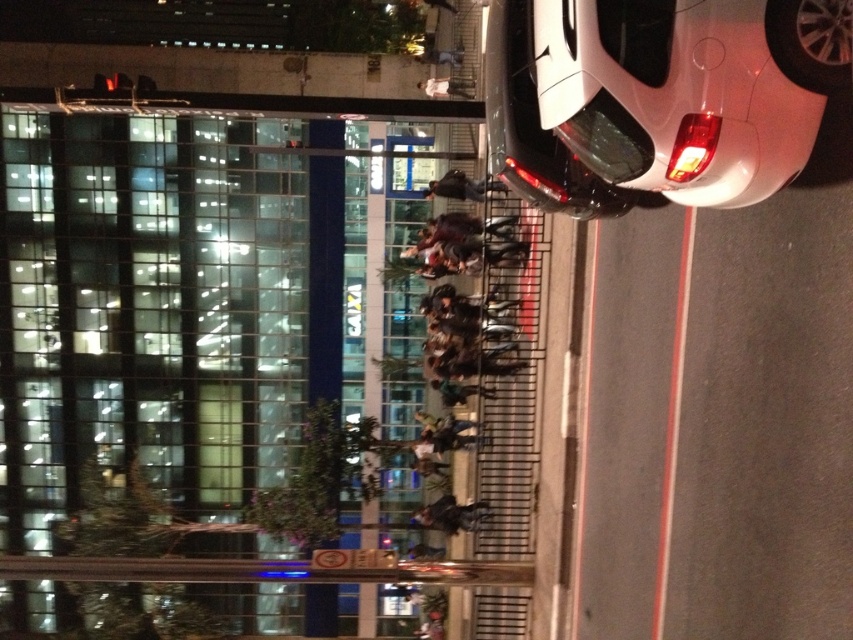
You are a photographer trying to capture a wide shot of the transparent glass building at upper left and the white glossy car at right. Based on their sizes in the image, which object would require a wider angle lens to include fully in the frame?

The transparent glass building at upper left requires a wider angle lens because its width surpasses that of the white glossy car at right, making it harder to fit into the frame without cropping.

You are a delivery driver who needs to turn left onto a street. You see the transparent glass building at upper left and the white glossy car at right. Which object is closer to you as you prepare to make the turn?

The transparent glass building at upper left is closer to you because the white glossy car at right is behind it, indicating the building is in front of the car.